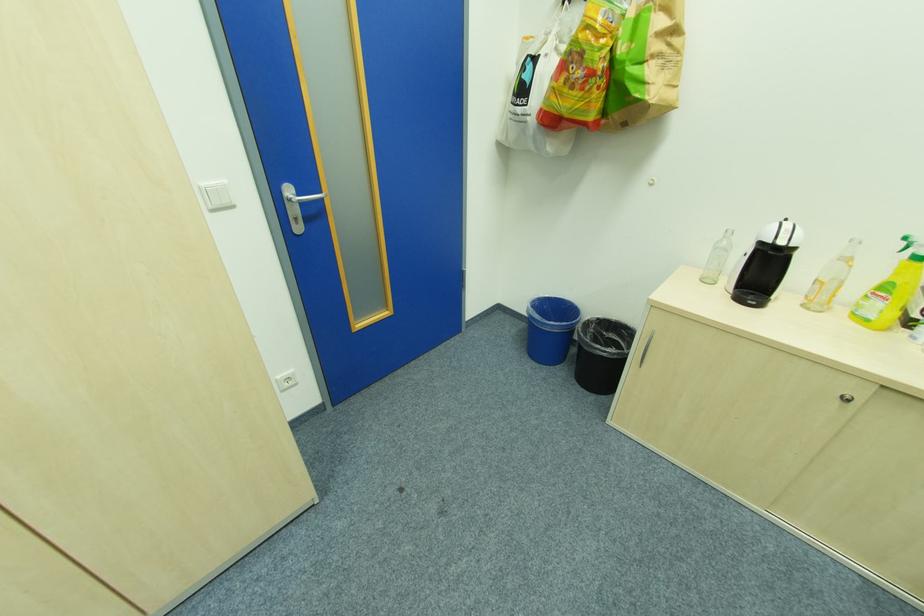
What do you see at coordinates (305, 198) in the screenshot? The height and width of the screenshot is (616, 924). I see `the silver door handle` at bounding box center [305, 198].